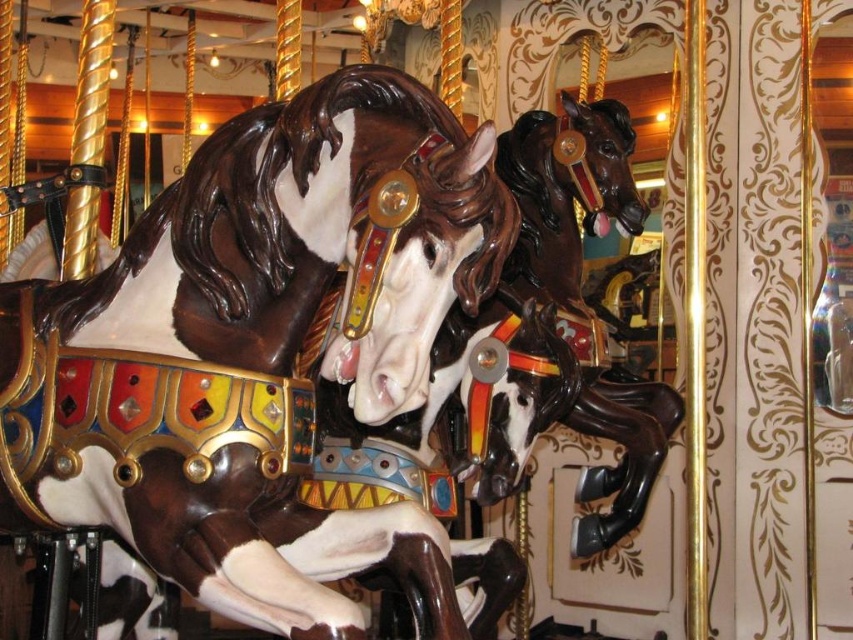
Describe the element at coordinates (289, 250) in the screenshot. I see `shiny brown horse at center` at that location.

Based on the photo, can you confirm if shiny brown horse at center is thinner than shiny dark brown horse at center?

No.

Which is behind, point (256, 561) or point (581, 371)?

Positioned behind is point (581, 371).

Where is `shiny brown horse at center`? shiny brown horse at center is located at coordinates (289, 250).